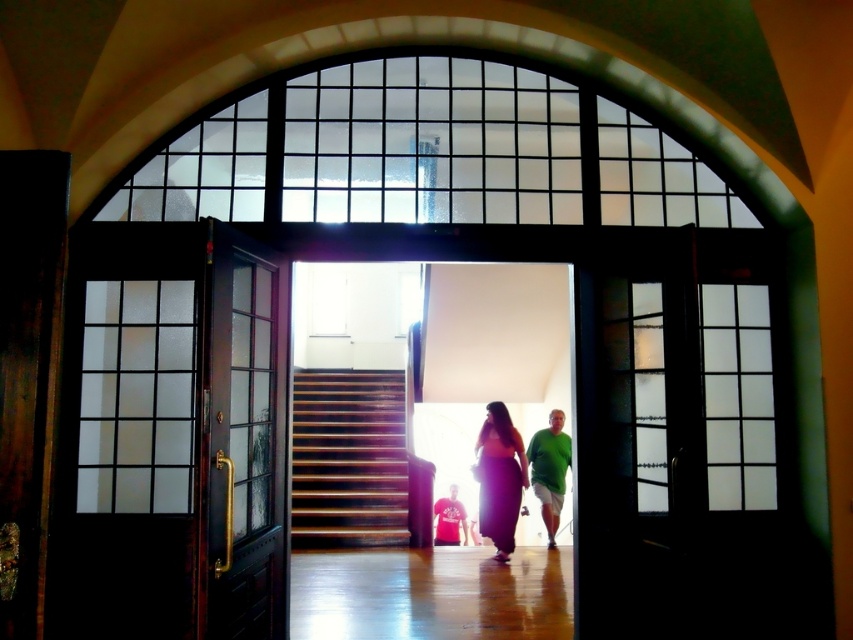
Who is more forward, (212, 490) or (518, 458)?

A: Point (212, 490) is more forward.

Can you confirm if matte black door at left is positioned below purple satin dress at center?

Incorrect, matte black door at left is not positioned below purple satin dress at center.

Locate an element on the screen. matte black door at left is located at coordinates (244, 436).

Is matte black door at left wider than matte red t-shirt at center?

Incorrect, matte black door at left's width does not surpass matte red t-shirt at center's.

Is matte black door at left below matte red t-shirt at center?

No.

Measure the distance between point (x=271, y=323) and camera.

Point (x=271, y=323) is 3.88 meters from camera.

The image size is (853, 640). Identify the location of matte black door at left. (244, 436).

What do you see at coordinates (347, 458) in the screenshot? I see `wooden stairs at center` at bounding box center [347, 458].

Who is more distant from viewer, [318,468] or [546,449]?

The point [318,468] is more distant.

Is point (306, 538) more distant than point (552, 540)?

No, (306, 538) is in front of (552, 540).

Find the location of a particular element. The image size is (853, 640). wooden stairs at center is located at coordinates (347, 458).